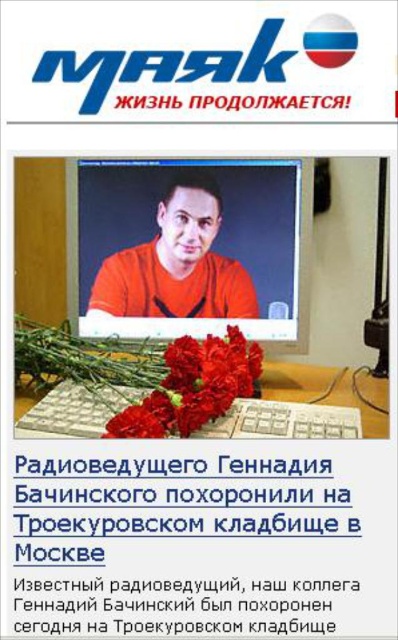
Does smooth red carnation at center come behind white plastic keyboard at lower center?

No, it is in front of white plastic keyboard at lower center.

The image size is (398, 640). I want to click on smooth red carnation at center, so click(193, 387).

Where is `smooth red carnation at center`? smooth red carnation at center is located at coordinates (193, 387).

Is matte plastic keyboard at lower center positioned in front of white plastic keyboard at lower center?

That is True.

Between matte plastic keyboard at lower center and white plastic keyboard at lower center, which one is positioned lower?

Positioned lower is white plastic keyboard at lower center.

What do you see at coordinates (282, 420) in the screenshot? The image size is (398, 640). I see `matte plastic keyboard at lower center` at bounding box center [282, 420].

What are the coordinates of `matte plastic keyboard at lower center` in the screenshot? It's located at (282, 420).

Between orange matte shirt at center and white plastic keyboard at lower center, which one is positioned lower?

white plastic keyboard at lower center is lower down.

This screenshot has height=640, width=398. What do you see at coordinates (177, 262) in the screenshot? I see `orange matte shirt at center` at bounding box center [177, 262].

Find the location of a particular element. This screenshot has height=640, width=398. orange matte shirt at center is located at coordinates (177, 262).

I want to click on orange matte shirt at center, so click(177, 262).